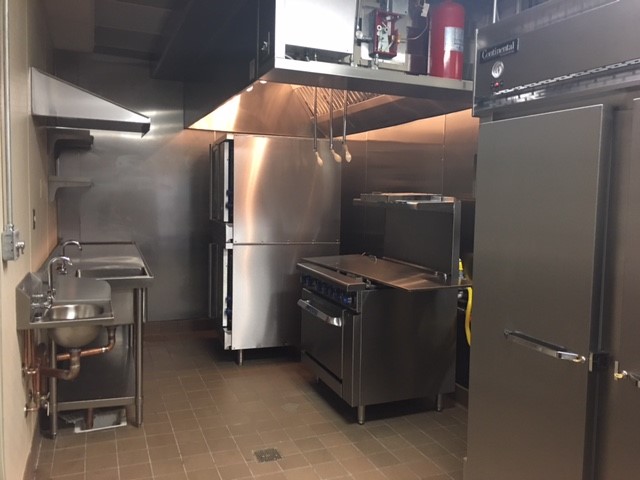
I want to click on light, so click(250, 87), click(264, 81).